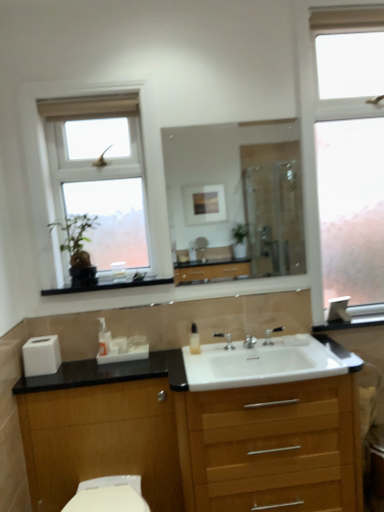
At what (x,y) coordinates should I click in order to perform the action: click on unoccupied area in front of white matte toilet paper at lower left. Please return your answer as a coordinate pair (x, y). Image resolution: width=384 pixels, height=512 pixels. Looking at the image, I should click on (40, 385).